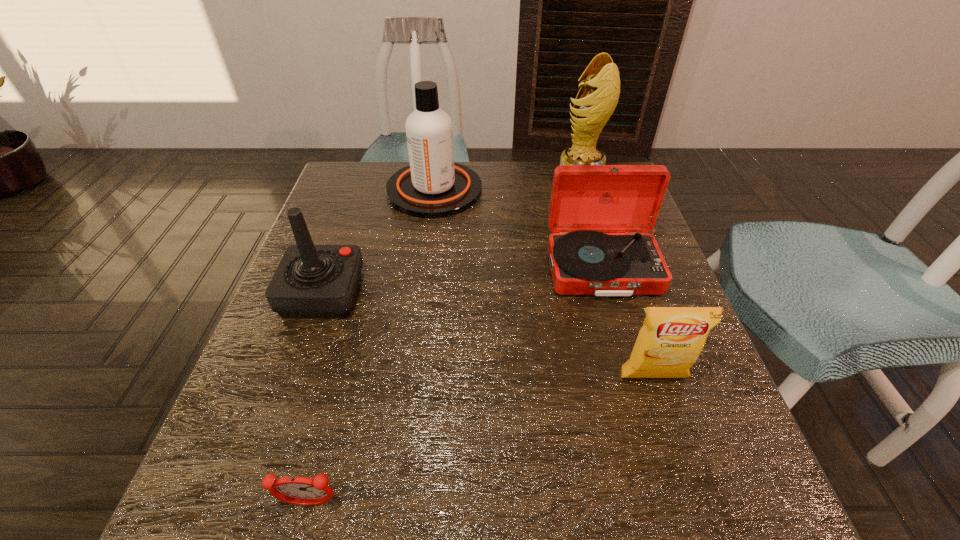
In the image, there is a desktop. At what (x,y) coordinates should I click in order to perform the action: click on free region at the far left corner. Please return your answer as a coordinate pair (x, y). This screenshot has width=960, height=540. Looking at the image, I should click on (379, 204).

You are a GUI agent. You are given a task and a screenshot of the screen. Output one action in this format:
    pyautogui.click(x=<x>, y=<y>)
    Task: Click on the vacant area that lies between the crisp (potato chip) and the joystick
    
    Given the screenshot: What is the action you would take?
    pyautogui.click(x=488, y=335)

The height and width of the screenshot is (540, 960). In order to click on free point between the phonograph_record and the joystick in this screenshot , I will do `click(463, 281)`.

Identify the location of vacant space in between the cleansing agent and the phonograph_record. [518, 230].

Find the location of a particular element. free space that is in between the joystick and the phonograph_record is located at coordinates (463, 281).

This screenshot has width=960, height=540. I want to click on empty location between the award and the cleansing agent, so click(x=507, y=184).

You are a GUI agent. You are given a task and a screenshot of the screen. Output one action in this format:
    pyautogui.click(x=<x>, y=<y>)
    Task: Click on the free space that is in between the shortest object and the joystick
    The width and height of the screenshot is (960, 540).
    Given the screenshot: What is the action you would take?
    pyautogui.click(x=316, y=398)

Identify the location of free area in between the shortest object and the joystick. The image size is (960, 540). (316, 398).

What are the coordinates of `vacant point located between the phonograph_record and the second nearest object` in the screenshot? It's located at (628, 323).

Point out which object is positioned as the second nearest to the award. Please provide its 2D coordinates. Your answer should be formatted as a tuple, i.e. [(x, y)], where the tuple contains the x and y coordinates of a point satisfying the conditions above.

[(586, 200)]